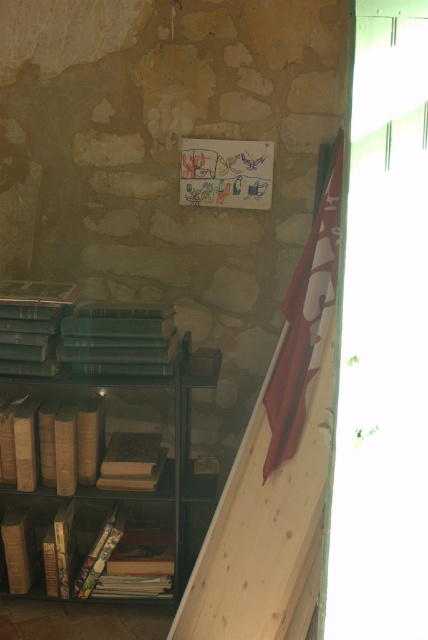
Is brown leather bookcase at lower left positioned behind wooden book at center?

No, it is in front of wooden book at center.

Find the location of a particular element. This screenshot has width=428, height=640. brown leather bookcase at lower left is located at coordinates (91, 435).

Which is behind, point (62, 284) or point (106, 472)?

The point (62, 284) is more distant.

Where is `brown leather bookcase at lower left`? The image size is (428, 640). brown leather bookcase at lower left is located at coordinates (91, 435).

Looking at this image, is green leather book at center wider than wooden book at center?

Indeed, green leather book at center has a greater width compared to wooden book at center.

Can you confirm if green leather book at center is positioned to the right of wooden book at center?

Incorrect, green leather book at center is not on the right side of wooden book at center.

Does point (32, 365) come closer to viewer compared to point (142, 472)?

Yes, point (32, 365) is in front of point (142, 472).

Identify the location of green leather book at center. (82, 333).

Can you confirm if brown leather bookcase at lower left is positioned above hardcover books at lower left?

Yes, brown leather bookcase at lower left is above hardcover books at lower left.

Does brown leather bookcase at lower left have a greater width compared to hardcover books at lower left?

Yes.

Between point (9, 300) and point (76, 534), which one is positioned in front?

Point (9, 300) is in front.

Locate an element on the screen. brown leather bookcase at lower left is located at coordinates (91, 435).